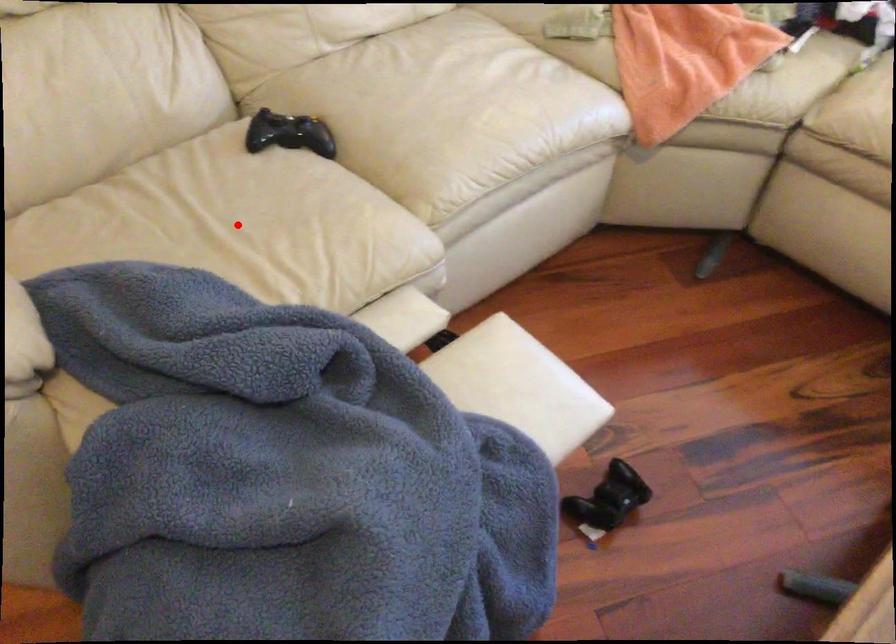
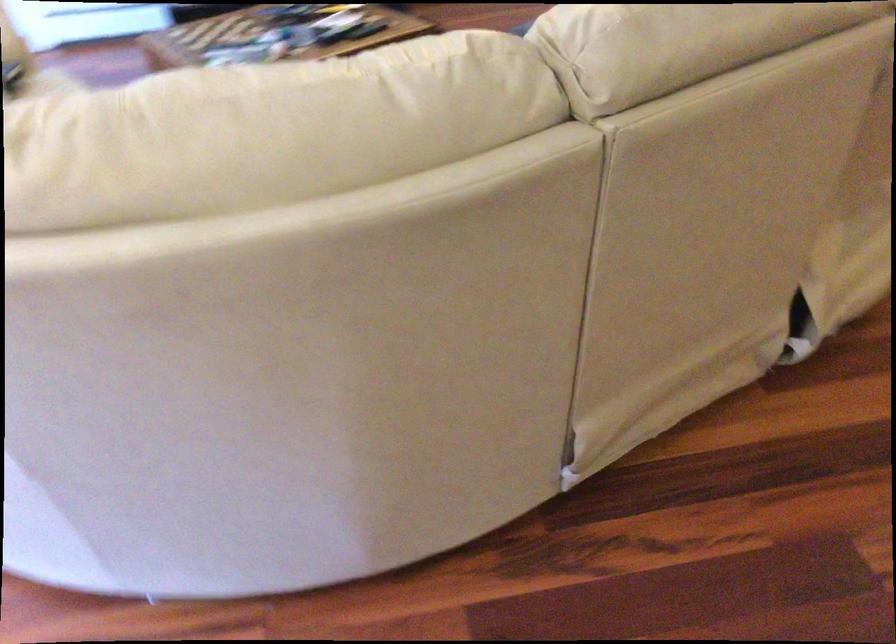
Question: I am providing you with two images of the same scene from different viewpoints. A red point is marked on the first image. At the location where the point appears in image 1, is it still visible in image 2?

Choices:
 (A) Yes
 (B) No

Answer: (B)